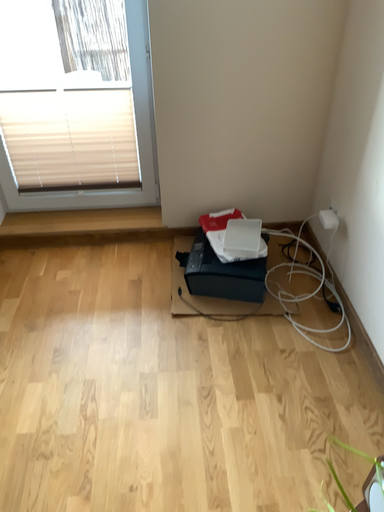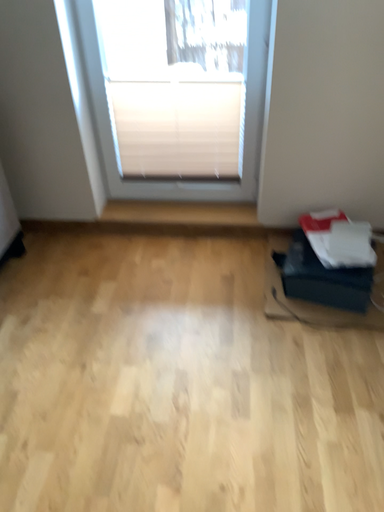
Question: How did the camera likely rotate when shooting the video?

Choices:
 (A) rotated right
 (B) rotated left

Answer: (B)